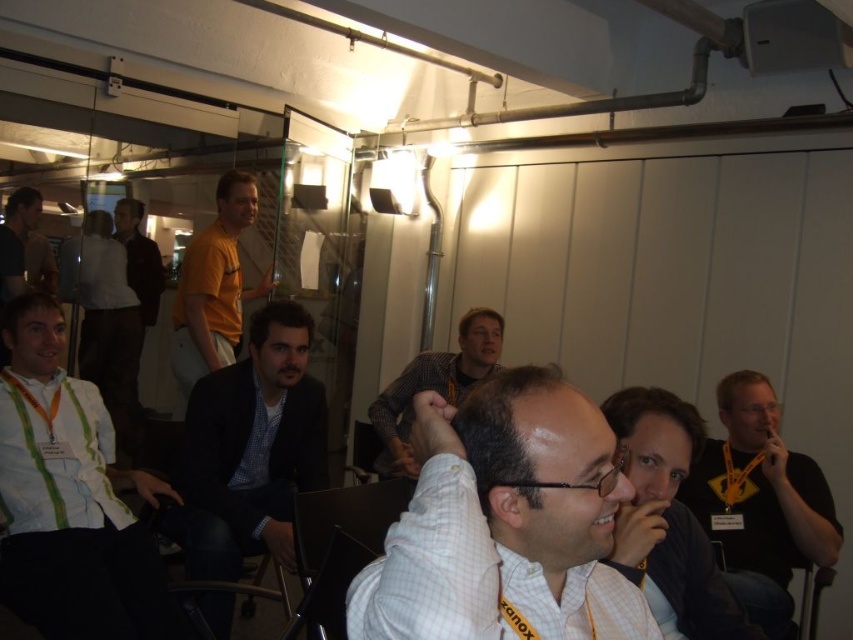
Which is behind, point (666, 531) or point (457, 372)?

The point (457, 372) is more distant.

Between point (677, 456) and point (428, 384), which one is positioned in front?

Point (677, 456) is in front.

What are the coordinates of `white shirt at center` in the screenshot? It's located at (668, 518).

Can you confirm if white checkered shirt at center is taller than orange t-shirt at center?

Incorrect, white checkered shirt at center's height is not larger of orange t-shirt at center's.

The image size is (853, 640). Describe the element at coordinates (503, 524) in the screenshot. I see `white checkered shirt at center` at that location.

This screenshot has width=853, height=640. In order to click on white checkered shirt at center in this screenshot , I will do `click(503, 524)`.

Is white checkered shirt at center further to camera compared to white striped shirt at lower left?

No, white checkered shirt at center is in front of white striped shirt at lower left.

Which is in front, point (593, 497) or point (68, 474)?

Positioned in front is point (593, 497).

You are a GUI agent. You are given a task and a screenshot of the screen. Output one action in this format:
    pyautogui.click(x=<x>, y=<y>)
    Task: Click on the white checkered shirt at center
    The image size is (853, 640).
    Given the screenshot: What is the action you would take?
    pyautogui.click(x=503, y=524)